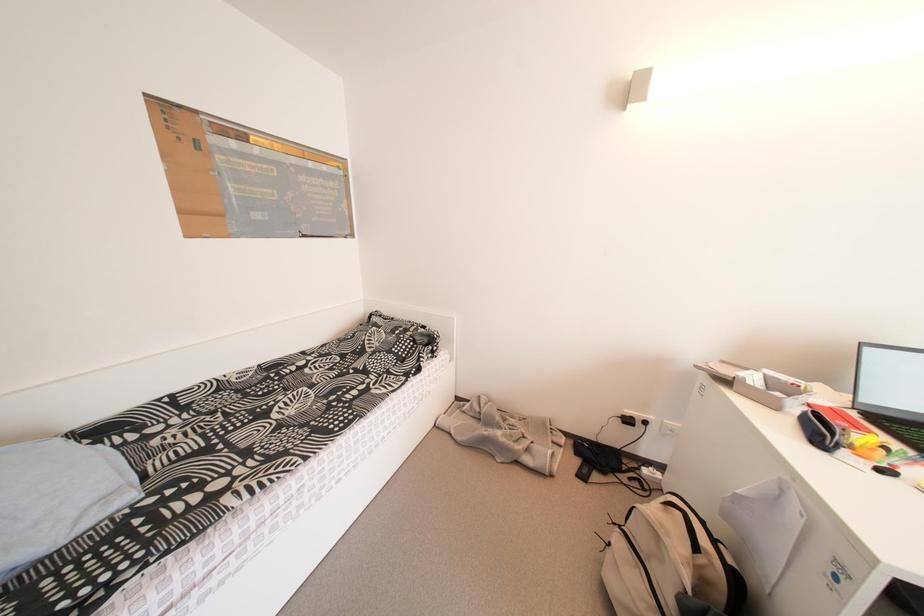
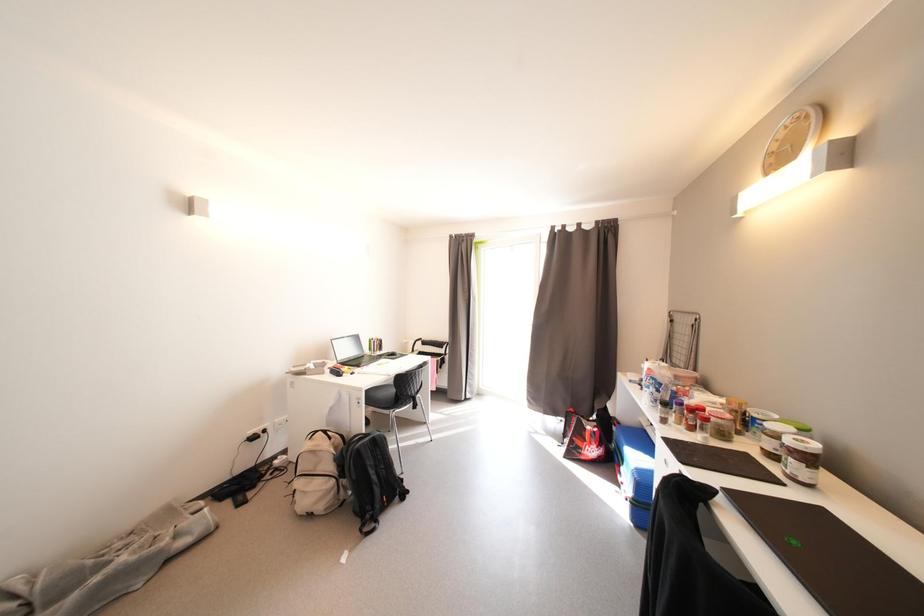
Question: How did the camera likely rotate?

Choices:
 (A) Left
 (B) Right
 (C) Up
 (D) Down

Answer: (B)